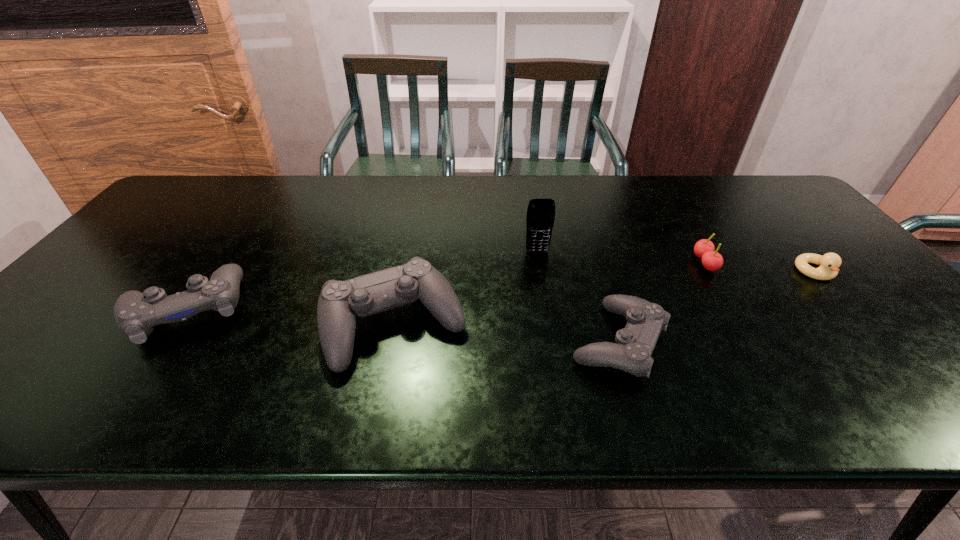
Locate an element on the screen. The image size is (960, 540). the second shortest control is located at coordinates (136, 314).

What are the coordinates of `the leftmost object` in the screenshot? It's located at (136, 314).

Where is `the second object from left to right`? This screenshot has width=960, height=540. the second object from left to right is located at coordinates (340, 302).

I want to click on the shortest control, so click(x=635, y=343).

You are a GUI agent. You are given a task and a screenshot of the screen. Output one action in this format:
    pyautogui.click(x=<x>, y=<y>)
    Task: Click on the third object from right to left
    
    Given the screenshot: What is the action you would take?
    pyautogui.click(x=635, y=343)

Identify the location of duckling. (828, 269).

Image resolution: width=960 pixels, height=540 pixels. In order to click on cellular telephone in this screenshot , I will do `click(540, 218)`.

Locate an element on the screen. This screenshot has width=960, height=540. the fourth object from right to left is located at coordinates (540, 218).

You are a GUI agent. You are given a task and a screenshot of the screen. Output one action in this format:
    pyautogui.click(x=<x>, y=<y>)
    Task: Click on the second object from right to left
    This screenshot has width=960, height=540.
    Given the screenshot: What is the action you would take?
    pyautogui.click(x=712, y=260)

Where is `free spot located 0.350m on the right of the second shortest control`? free spot located 0.350m on the right of the second shortest control is located at coordinates (390, 309).